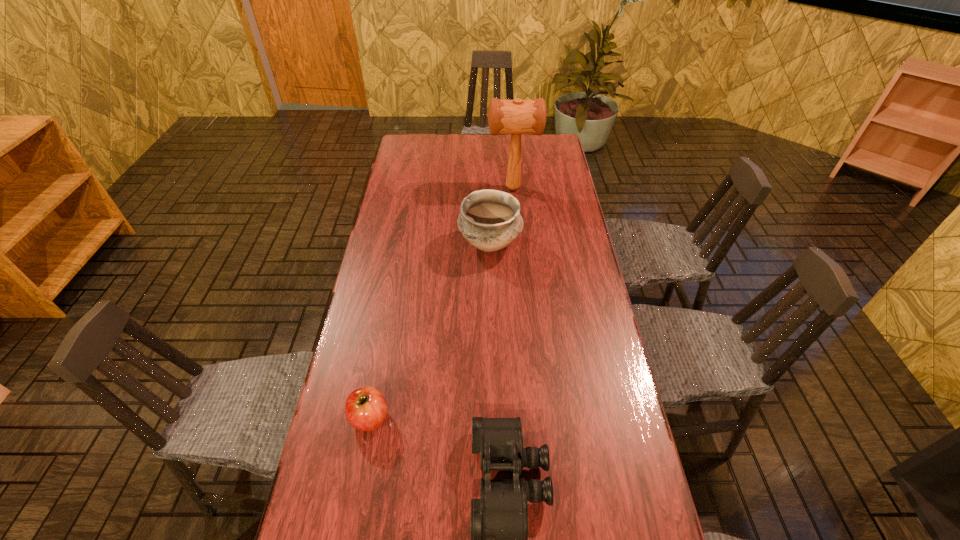
The image size is (960, 540). Identify the location of mallet. (515, 117).

Identify the location of the farthest object. This screenshot has width=960, height=540. (515, 117).

Find the location of `the second tallest object`. the second tallest object is located at coordinates (490, 220).

Locate an element on the screen. The width and height of the screenshot is (960, 540). the third nearest object is located at coordinates (490, 220).

Identify the location of the leftmost object. The height and width of the screenshot is (540, 960). (366, 409).

Find the location of a particular element. vacant space situated 0.290m on the strike surface of the farthest object is located at coordinates (416, 188).

Where is `free location located on the strike surface of the farthest object`? Image resolution: width=960 pixels, height=540 pixels. free location located on the strike surface of the farthest object is located at coordinates (447, 188).

The height and width of the screenshot is (540, 960). Find the location of `free space located on the strike surface of the farthest object`. free space located on the strike surface of the farthest object is located at coordinates (465, 188).

In order to click on vacant position located on the back of the second tallest object in this screenshot , I will do `click(490, 212)`.

What are the coordinates of `free space located 0.050m on the front of the leftmost object` in the screenshot? It's located at (363, 458).